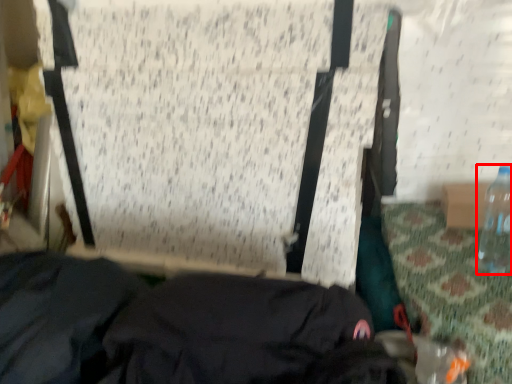
Question: Where is bottle (annotated by the red box) located in relation to clothing in the image?

Choices:
 (A) left
 (B) right

Answer: (B)